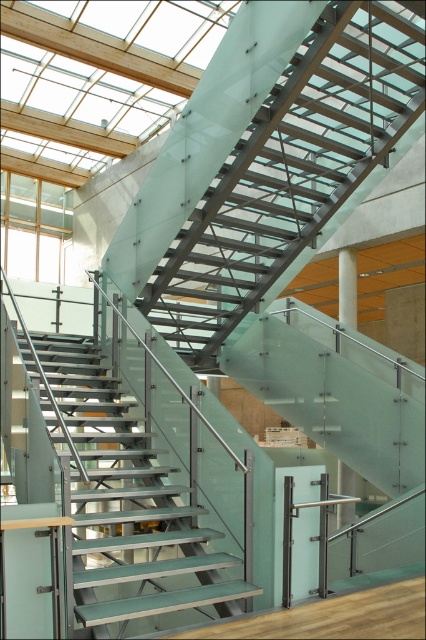
You are a delivery person carrying a heavy package and need to navigate the staircase. The green glass stairs at center and the white glossy pillar at center are in your path. Which object will you encounter first while ascending the staircase?

You will encounter the green glass stairs at center first because it is located below the white glossy pillar at center, meaning it is positioned lower on the staircase and comes before the pillar when moving upwards.

You are standing at the base of the modern staircase and want to reach a specific point marked as point (134, 422) on the staircase. If your reach extends 1.5 meters from your current position, can you touch this point without moving closer?

The point (134, 422) is 6.98 meters away from the viewer. Since your reach only extends 1.5 meters, you cannot touch the point without moving closer.